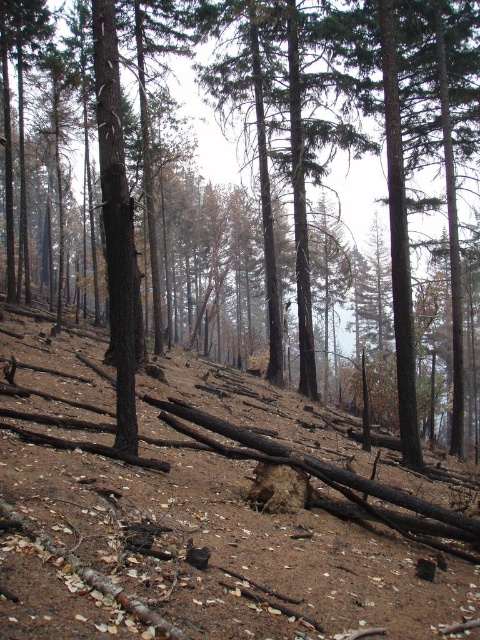
Does brown dirt at center appear on the left side of brown wood tree at center?

No, brown dirt at center is not to the left of brown wood tree at center.

Does brown dirt at center appear on the right side of brown wood tree at center?

Indeed, brown dirt at center is positioned on the right side of brown wood tree at center.

Is point (225, 611) closer to camera compared to point (429, 100)?

Yes, point (225, 611) is closer to viewer.

I want to click on brown dirt at center, so click(x=208, y=515).